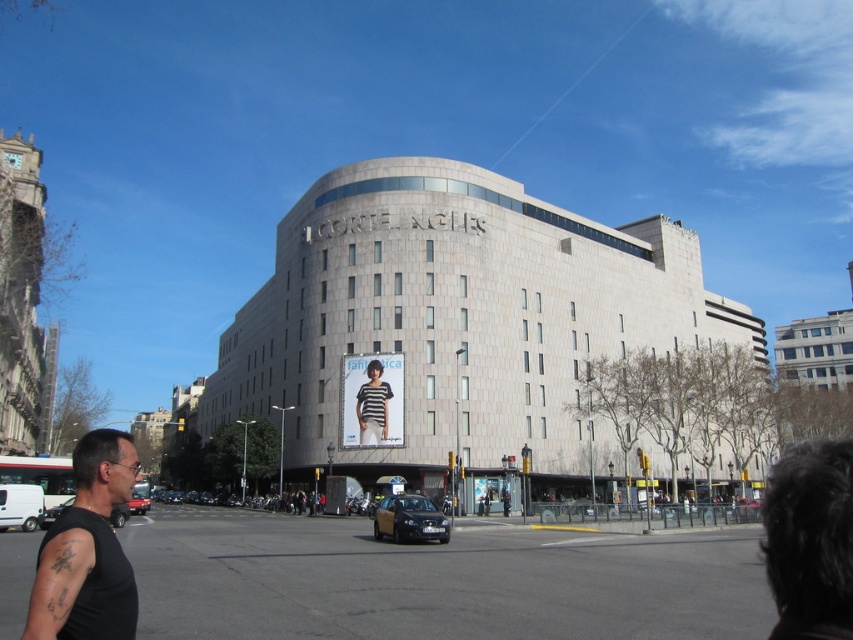
You are standing at the entrance of the building and see the point marked at coordinates (86, 550). What object is located at that point?

The point at coordinates (86, 550) corresponds to the black matte tank top at lower left.

You are standing in front of the building named CONTE NORIES. You want to know how far the point at coordinates point (x=120, y=596) is from your current position. Can you determine the distance?

The point (x=120, y=596) is 66.14 feet away from your current position.

You are a fashion designer observing the scene. You notice the black matte tank top at lower left and the striped fabric shirt at center. Which clothing item is closer to you in the image?

The black matte tank top at lower left is closer to you since it is positioned in front of the striped fabric shirt at center.